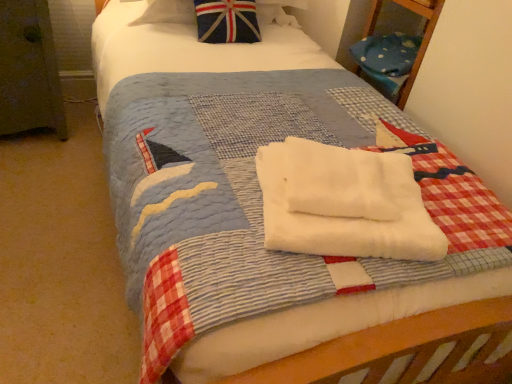
Question: Which is correct: white soft towel at center, which is counted as the first beach towel, starting from the top, is inside white soft towel at center, which is the second beach towel from top to bottom, or outside of it?

Choices:
 (A) inside
 (B) outside

Answer: (A)

Question: From the image's perspective, is white soft towel at center, which is counted as the first beach towel, starting from the top, above or below white soft towel at center, the first beach towel ordered from the bottom?

Choices:
 (A) above
 (B) below

Answer: (A)

Question: Estimate the real-world distances between objects in this image. Which object is closer to the white soft towel at center, the 2th beach towel in the bottom-to-top sequence?

Choices:
 (A) union jack fabric pillow at upper center
 (B) white soft towel at center, the first beach towel ordered from the bottom

Answer: (B)

Question: Which is farther from the union jack fabric pillow at upper center?

Choices:
 (A) white soft towel at center, the first beach towel ordered from the bottom
 (B) white soft towel at center, which is counted as the first beach towel, starting from the top

Answer: (A)